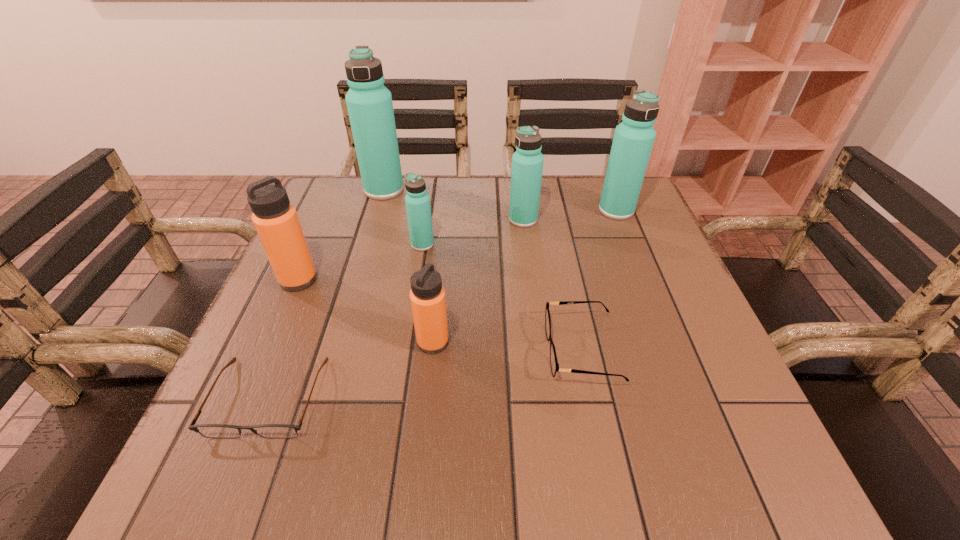
This screenshot has width=960, height=540. Find the location of `the smaller orange thermos bottle`. the smaller orange thermos bottle is located at coordinates (427, 295).

Identify the location of the nearer orange thermos bottle. The image size is (960, 540). (427, 295).

The height and width of the screenshot is (540, 960). Find the location of `the taller spectacles`. the taller spectacles is located at coordinates pos(554,364).

At what (x,y) coordinates should I click in order to perform the action: click on the right spectacles. Please return your answer as a coordinate pair (x, y). This screenshot has height=540, width=960. Looking at the image, I should click on (554, 364).

Identify the location of the shorter spectacles. (222, 431).

Locate an element on the screen. The image size is (960, 540). the shortest object is located at coordinates (222, 431).

You are a GUI agent. You are given a task and a screenshot of the screen. Output one action in this format:
    pyautogui.click(x=<x>, y=<y>)
    Task: Click on the vacant space located on the right of the tallest object
    
    Given the screenshot: What is the action you would take?
    pyautogui.click(x=451, y=190)

Where is `vacant space located 0.140m on the front of the second tallest object`? The width and height of the screenshot is (960, 540). vacant space located 0.140m on the front of the second tallest object is located at coordinates (635, 257).

The height and width of the screenshot is (540, 960). I want to click on free spot located on the back of the second thermos bottle from right to left, so click(519, 186).

The width and height of the screenshot is (960, 540). I want to click on free space located 0.300m on the front of the fifth farthest object, so click(x=233, y=427).